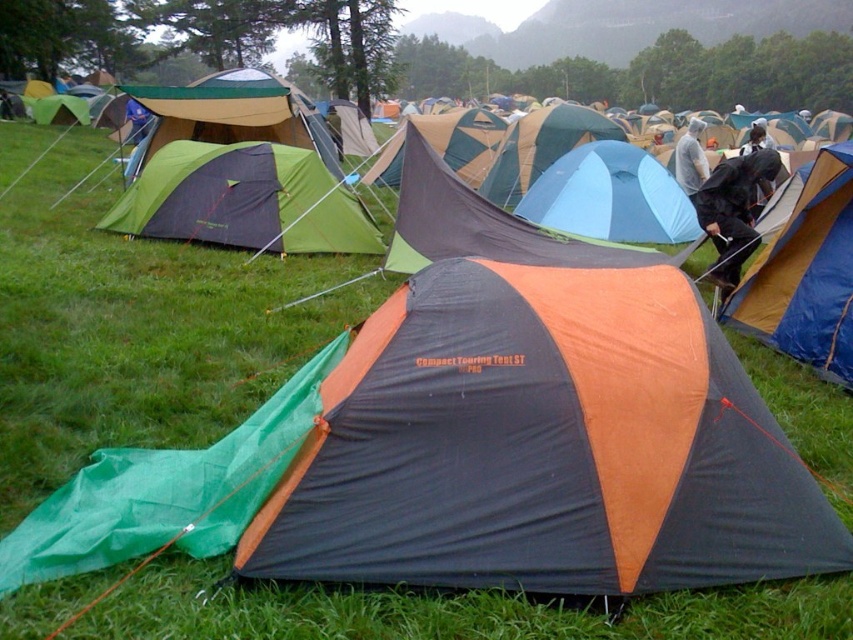
Looking at this image, between orange fabric tent at right and black fabric bag at center, which one appears on the right side from the viewer's perspective?

black fabric bag at center

Who is shorter, orange fabric tent at right or black fabric bag at center?

orange fabric tent at right is shorter.

Does point (827, 284) come behind point (751, 205)?

No, it is in front of (751, 205).

Locate an element on the screen. The width and height of the screenshot is (853, 640). orange fabric tent at right is located at coordinates (805, 272).

Between green fabric tent at upper center and orange and gray tent at center, which one appears on the left side from the viewer's perspective?

From the viewer's perspective, green fabric tent at upper center appears more on the left side.

Looking at this image, between green fabric tent at upper center and orange and gray tent at center, which one has less height?

Standing shorter between the two is green fabric tent at upper center.

Is point (219, 113) closer to camera compared to point (434, 116)?

Yes, it is.

Find the location of a particular element. Image resolution: width=853 pixels, height=640 pixels. green fabric tent at upper center is located at coordinates (234, 115).

Can you confirm if blue fabric tent at center is smaller than green fabric tent at upper center?

Yes.

Measure the distance from blue fabric tent at center to green fabric tent at upper center.

The distance of blue fabric tent at center from green fabric tent at upper center is 4.14 meters.

What do you see at coordinates (610, 196) in the screenshot? I see `blue fabric tent at center` at bounding box center [610, 196].

In order to click on blue fabric tent at center in this screenshot , I will do `click(610, 196)`.